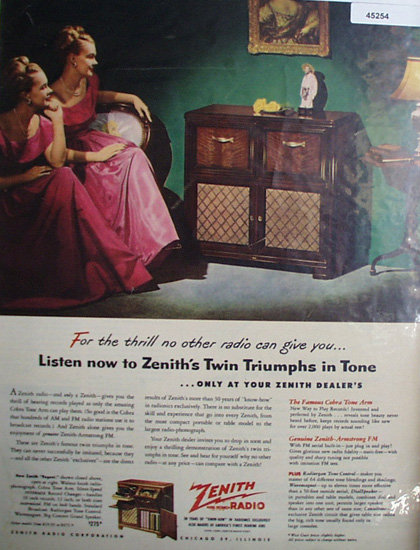
Identify the location of frame. The width and height of the screenshot is (420, 550). [322, 49].